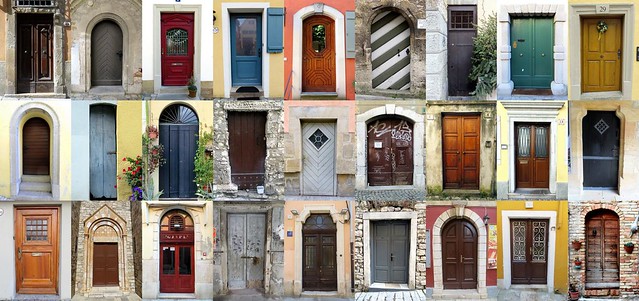
At what (x,y) coordinates should I click in order to perform the action: click on doors with windows. Please return your answer as a coordinate pair (x, y). Image resolution: width=639 pixels, height=301 pixels. Looking at the image, I should click on (174, 64), (250, 47), (321, 70), (468, 62), (528, 165), (318, 157), (38, 260), (179, 251), (534, 257).